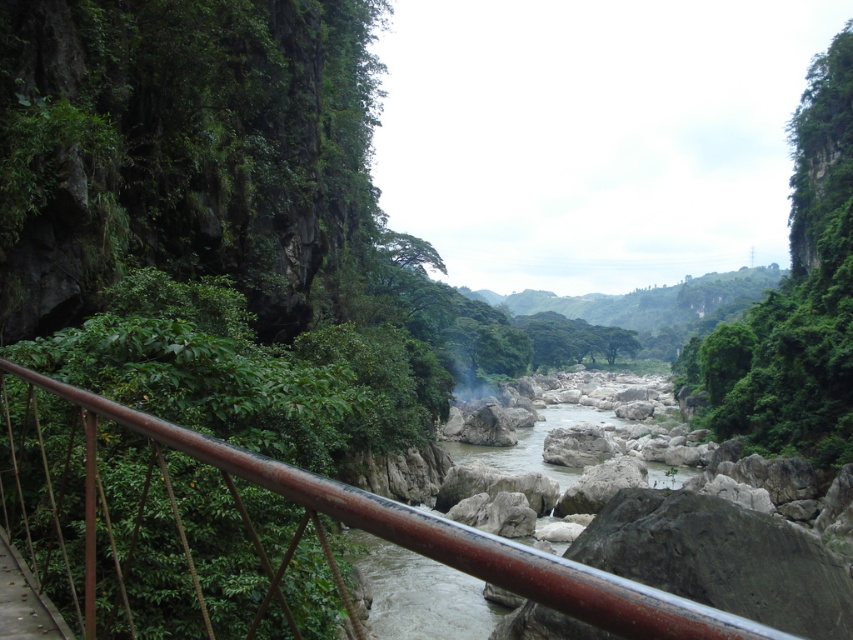
You are standing at the center of the image and want to cross the river to the other side. There is a rusty metal railing at lower left located at point (x=440, y=536). Which direction should you walk to reach the railing?

To reach the rusty metal railing at lower left located at point (x=440, y=536), you should walk towards the lower left direction from the center of the image.

You are a hiker who wants to cross the river using the white smooth rocks at center. However, you notice the green leafy vegetation at upper center nearby. Which object takes up more space in the image?

The green leafy vegetation at upper center takes up more space in the image than the white smooth rocks at center because it is bigger according to the description.